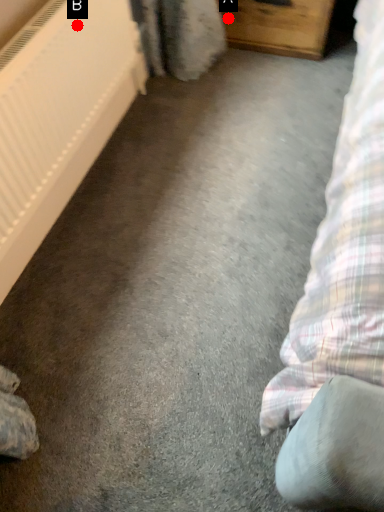
Question: Two points are circled on the image, labeled by A and B beside each circle. Among these points, which one is farthest from the camera?

Choices:
 (A) A is further
 (B) B is further

Answer: (A)